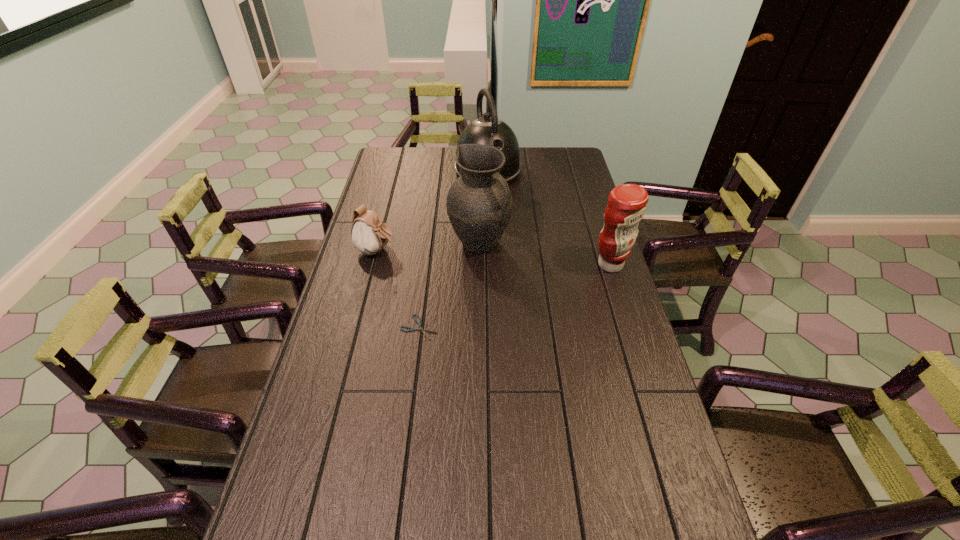
Find the location of a particular element. The width and height of the screenshot is (960, 540). the shortest object is located at coordinates (419, 323).

This screenshot has width=960, height=540. I want to click on shears, so click(419, 323).

The image size is (960, 540). In order to click on the third shortest object in this screenshot , I will do pos(626,206).

At what (x,y) coordinates should I click in order to perform the action: click on the rightmost object. Please return your answer as a coordinate pair (x, y). Looking at the image, I should click on (626, 206).

Find the location of a particular element. Image resolution: width=960 pixels, height=540 pixels. pitcher is located at coordinates (479, 203).

You are a GUI agent. You are given a task and a screenshot of the screen. Output one action in this format:
    pyautogui.click(x=<x>, y=<y>)
    Task: Click on the kettle
    The image size is (960, 540).
    Given the screenshot: What is the action you would take?
    pyautogui.click(x=486, y=130)

At what (x,y) coordinates should I click in order to perform the action: click on pouch. Please return your answer as a coordinate pair (x, y). Looking at the image, I should click on (369, 233).

Where is `the second shortest object`? the second shortest object is located at coordinates (369, 233).

At what (x,y) coordinates should I click in order to perform the action: click on vacant region located 0.140m on the left of the shortest object. Please return your answer as a coordinate pair (x, y). The width and height of the screenshot is (960, 540). Looking at the image, I should click on (353, 328).

The height and width of the screenshot is (540, 960). Find the location of `free region located on the front of the condiment`. free region located on the front of the condiment is located at coordinates (632, 330).